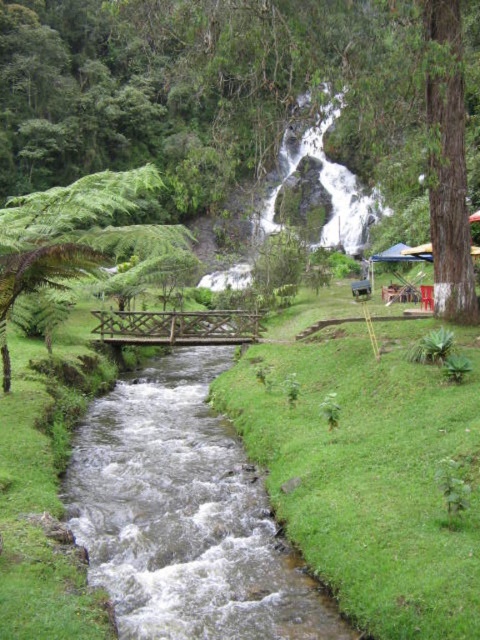
You are standing at the edge of the scene and want to cross the stream using the wooden bridge. As you look towards the green grass at center and the clear water stream at center, which one do you see first?

The green grass at center is closer to the viewer than the clear water stream at center, so you will see the green grass at center first when looking towards them.

You are standing at the point labeled point at (320, 380). You need to cross the stream to reach the hillside beyond the wooden bridge. Can you safely walk across the wooden bridge to get there?

The wooden bridge crosses the stream, so yes, you can safely walk across the wooden bridge to reach the hillside beyond it.

You are standing on the wooden bridge and looking towards the green leafy tree at left. Which direction should you walk to reach the green grass at center?

The green grass at center is positioned under the green leafy tree at left, so you should walk towards the base of the tree to reach the green grass at center.